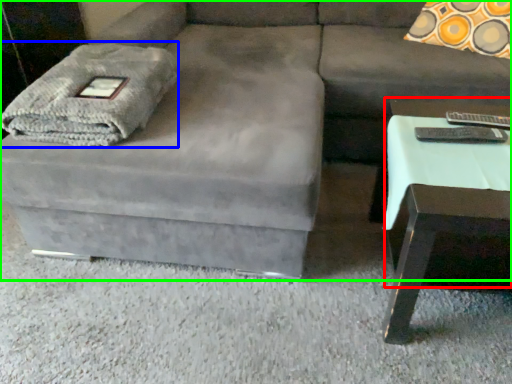
Question: Estimate the real-world distances between objects in this image. Which object is closer to side table (highlighted by a red box), blanket (highlighted by a blue box) or studio couch (highlighted by a green box)?

Choices:
 (A) blanket
 (B) studio couch

Answer: (B)